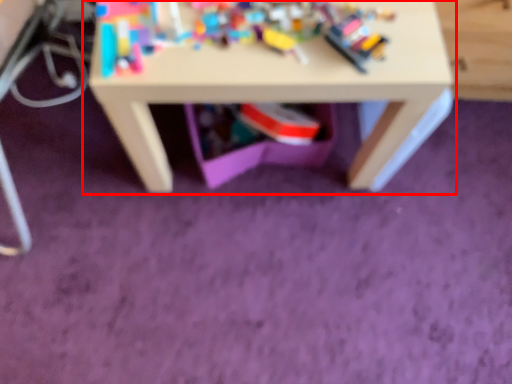
Question: From the image's perspective, what is the correct spatial positioning of table (annotated by the red box) in reference to toy?

Choices:
 (A) above
 (B) below

Answer: (A)